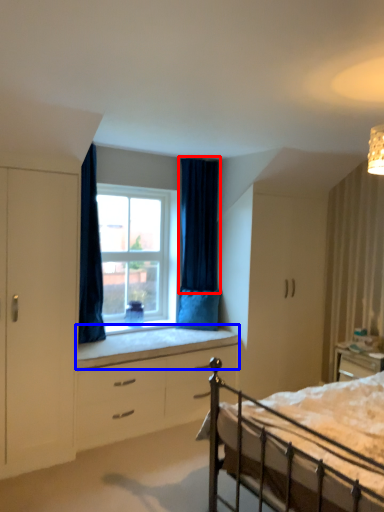
Question: Which of the following is the farthest to the observer, curtain (highlighted by a red box) or window sill (highlighted by a blue box)?

Choices:
 (A) curtain
 (B) window sill

Answer: (A)